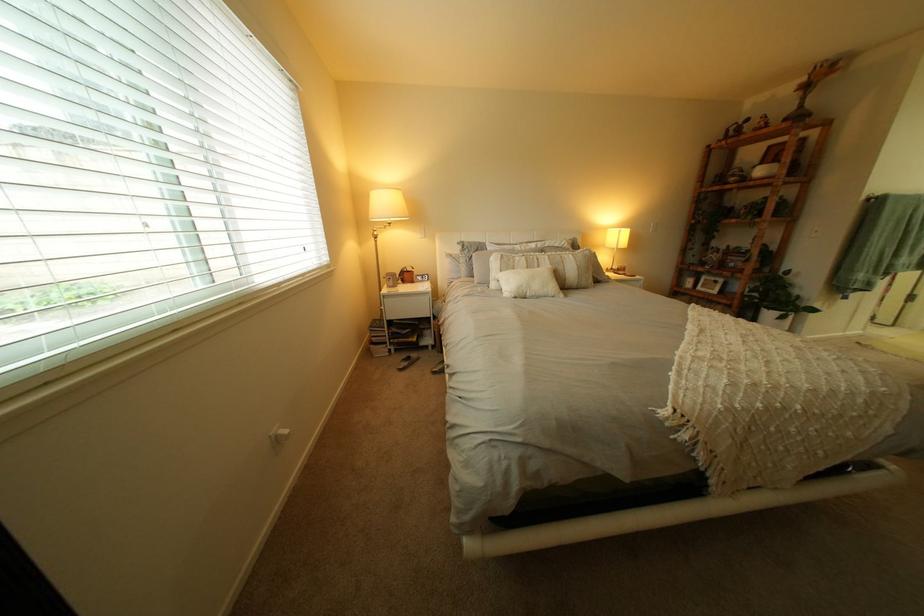
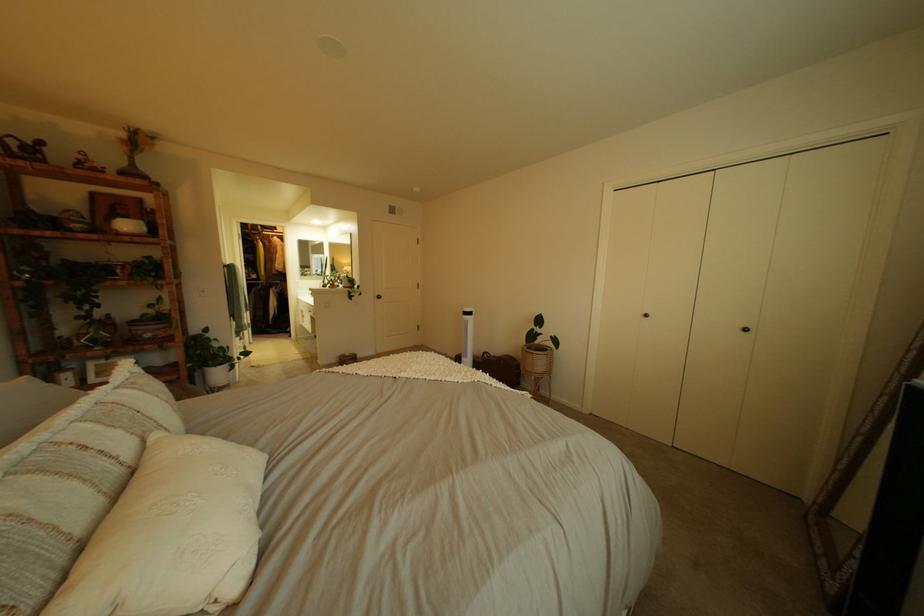
Where in the second image is the point corresponding to (820,81) from the first image?

(139, 137)